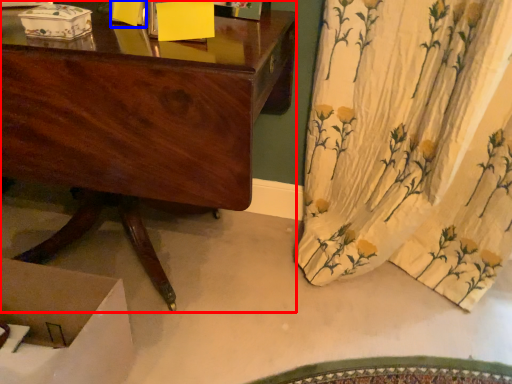
Question: Which object is further to the camera taking this photo, desk (highlighted by a red box) or box (highlighted by a blue box)?

Choices:
 (A) desk
 (B) box

Answer: (B)